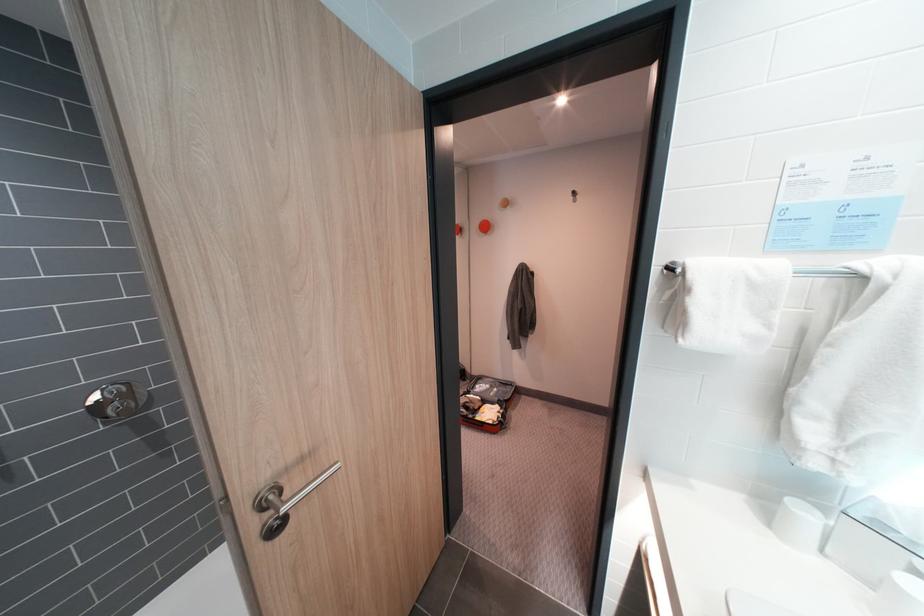
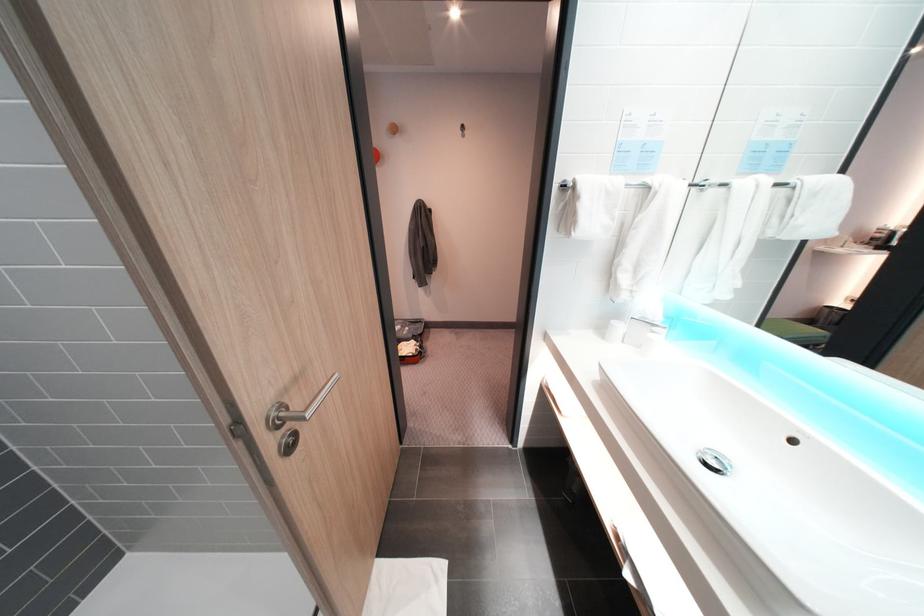
Question: How did the camera likely rotate?

Choices:
 (A) Left
 (B) Right
 (C) Up
 (D) Down

Answer: (B)